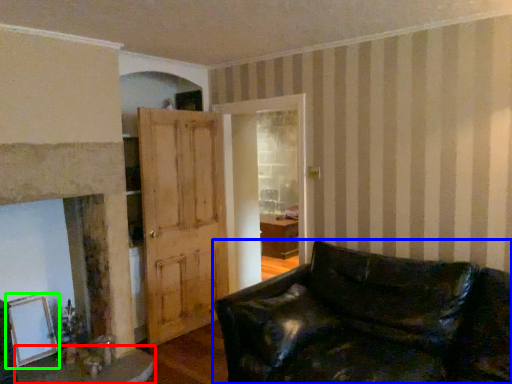
Question: Which object is positioned closest to table (highlighted by a red box)? Select from studio couch (highlighted by a blue box) and picture frame (highlighted by a green box).

Choices:
 (A) studio couch
 (B) picture frame

Answer: (B)